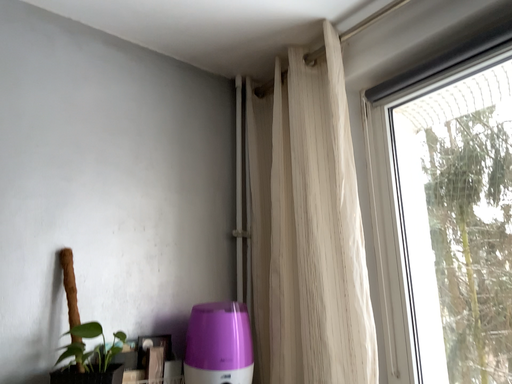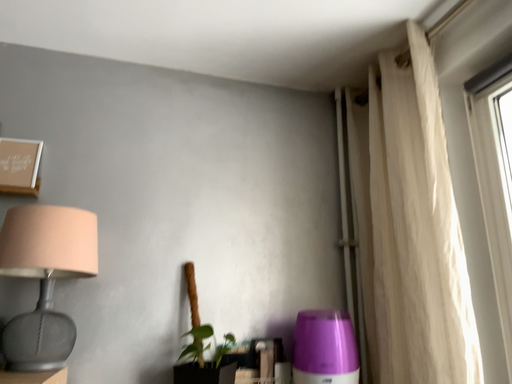
Question: Which way did the camera rotate in the video?

Choices:
 (A) rotated right
 (B) rotated left

Answer: (B)